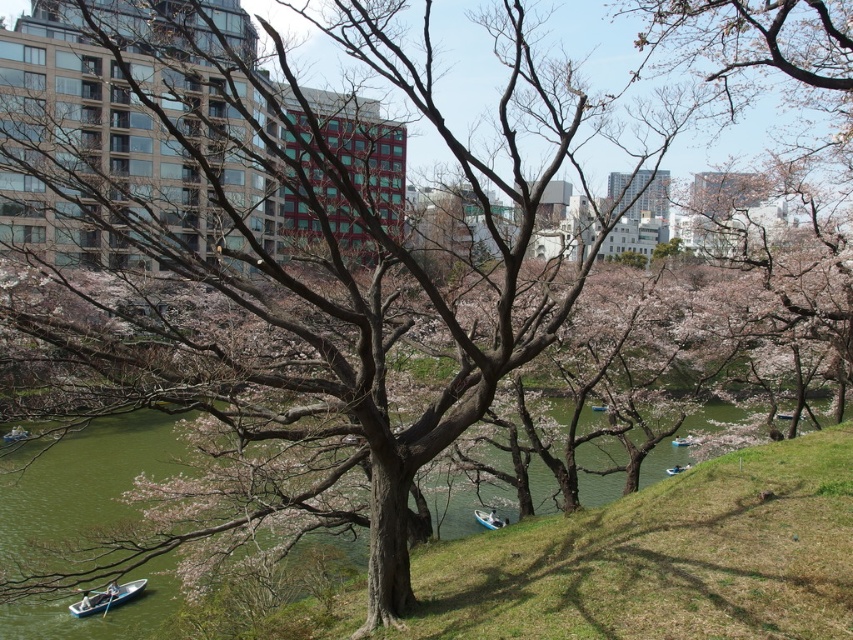
Question: Which point is closer to the camera?

Choices:
 (A) (108, 582)
 (B) (492, 513)
 (C) (674, 467)
 (D) (689, 433)

Answer: (A)

Question: Which object is farther from the camera taking this photo?

Choices:
 (A) white plastic boat at center
 (B) white plastic boat at lower center
 (C) white plastic boat at lower right

Answer: (C)

Question: Among these objects, which one is nearest to the camera?

Choices:
 (A) white plastic boat at center
 (B) white plastic boat at lower center

Answer: (B)

Question: Can you confirm if white plastic boat at lower left is wider than white plastic boat at lower center?

Choices:
 (A) no
 (B) yes

Answer: (A)

Question: Does white plastic boat at lower left have a lesser width compared to white plastic boat at lower center?

Choices:
 (A) no
 (B) yes

Answer: (B)

Question: Does white plastic boat at lower left appear on the right side of white plastic boat at lower center?

Choices:
 (A) no
 (B) yes

Answer: (A)